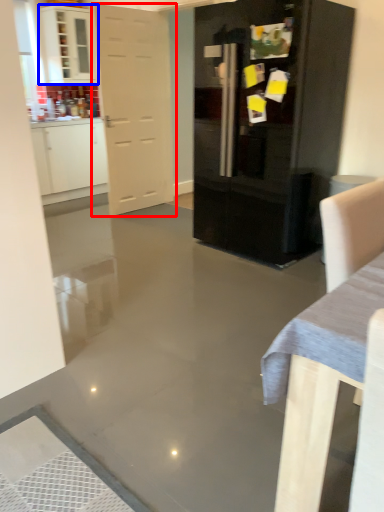
Question: Among these objects, which one is nearest to the camera, door (highlighted by a red box) or cabinetry (highlighted by a blue box)?

Choices:
 (A) door
 (B) cabinetry

Answer: (A)